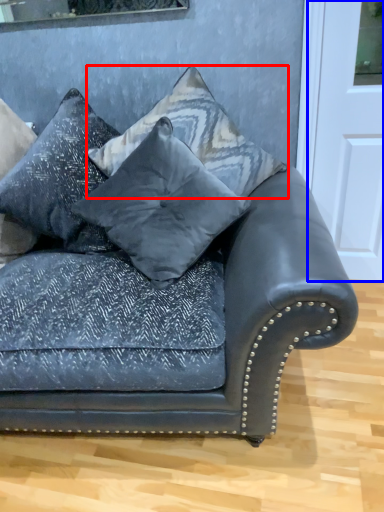
Question: Which object appears farthest to the camera in this image, pillow (highlighted by a red box) or door (highlighted by a blue box)?

Choices:
 (A) pillow
 (B) door

Answer: (B)